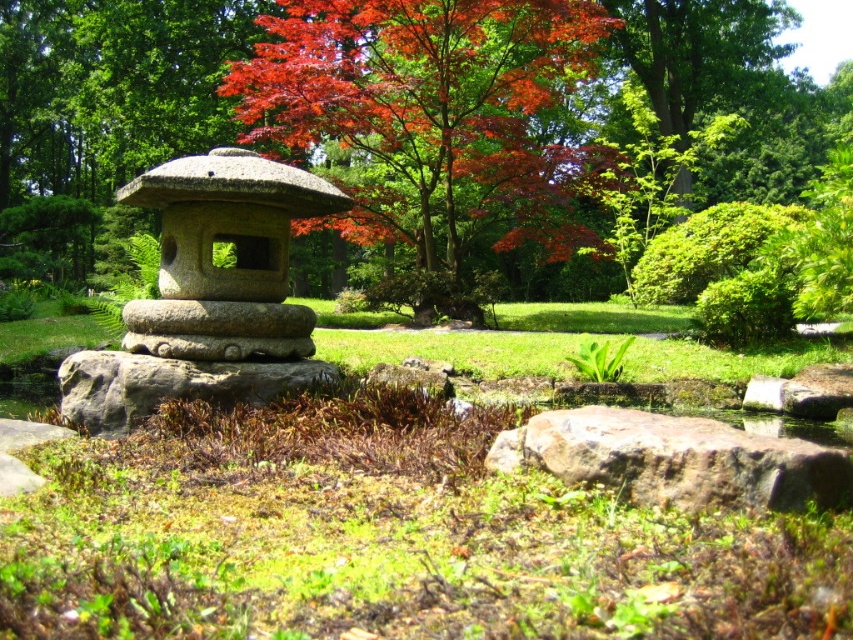
Is red leafy tree at center thinner than brown rough rock at center?

No, red leafy tree at center is not thinner than brown rough rock at center.

From the picture: How far apart are red leafy tree at center and brown rough rock at center?

The distance of red leafy tree at center from brown rough rock at center is 21.95 meters.

Does point (9, 221) lie behind point (718, 477)?

Yes, it is.

Find the location of a particular element. The height and width of the screenshot is (640, 853). red leafy tree at center is located at coordinates (410, 125).

Does point (270, 132) lie in front of point (283, 374)?

No, it is not.

From the picture: Is red leafy maple at center closer to camera compared to gray rough stone at center?

No, red leafy maple at center is behind gray rough stone at center.

Is point (378, 52) positioned in front of point (274, 381)?

No, (378, 52) is behind (274, 381).

Where is `red leafy maple at center`? red leafy maple at center is located at coordinates (431, 113).

Does point (405, 26) come behind point (184, 234)?

That is True.

The height and width of the screenshot is (640, 853). Describe the element at coordinates (431, 113) in the screenshot. I see `red leafy maple at center` at that location.

Where is `red leafy maple at center`? The height and width of the screenshot is (640, 853). red leafy maple at center is located at coordinates (431, 113).